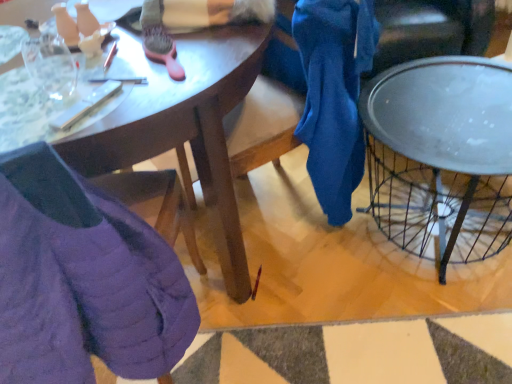
Question: Should I look upward or downward to see metallic silver tray at right?

Choices:
 (A) down
 (B) up

Answer: (B)

Question: Is matte wooden desk at center far away from purple quilted jacket at lower left?

Choices:
 (A) no
 (B) yes

Answer: (A)

Question: Is the depth of matte wooden desk at center greater than that of purple quilted jacket at lower left?

Choices:
 (A) no
 (B) yes

Answer: (B)

Question: From a real-world perspective, is matte wooden desk at center under purple quilted jacket at lower left?

Choices:
 (A) yes
 (B) no

Answer: (A)

Question: From the image's perspective, is matte wooden desk at center over purple quilted jacket at lower left?

Choices:
 (A) no
 (B) yes

Answer: (B)

Question: Is matte wooden desk at center next to purple quilted jacket at lower left and touching it?

Choices:
 (A) no
 (B) yes

Answer: (A)

Question: Is matte wooden desk at center closer to the viewer compared to purple quilted jacket at lower left?

Choices:
 (A) no
 (B) yes

Answer: (A)

Question: Can you confirm if purple quilted jacket at lower left is bigger than matte wooden desk at center?

Choices:
 (A) yes
 (B) no

Answer: (B)

Question: From the image's perspective, is purple quilted jacket at lower left on top of matte wooden desk at center?

Choices:
 (A) yes
 (B) no

Answer: (B)

Question: From the image's perspective, is purple quilted jacket at lower left located beneath matte wooden desk at center?

Choices:
 (A) no
 (B) yes

Answer: (B)

Question: Is purple quilted jacket at lower left far away from matte wooden desk at center?

Choices:
 (A) no
 (B) yes

Answer: (A)

Question: Does purple quilted jacket at lower left have a greater width compared to matte wooden desk at center?

Choices:
 (A) yes
 (B) no

Answer: (B)

Question: Could matte wooden desk at center be considered to be inside purple quilted jacket at lower left?

Choices:
 (A) yes
 (B) no

Answer: (B)

Question: Is metallic silver tray at right inside matte wooden desk at center?

Choices:
 (A) no
 (B) yes

Answer: (A)